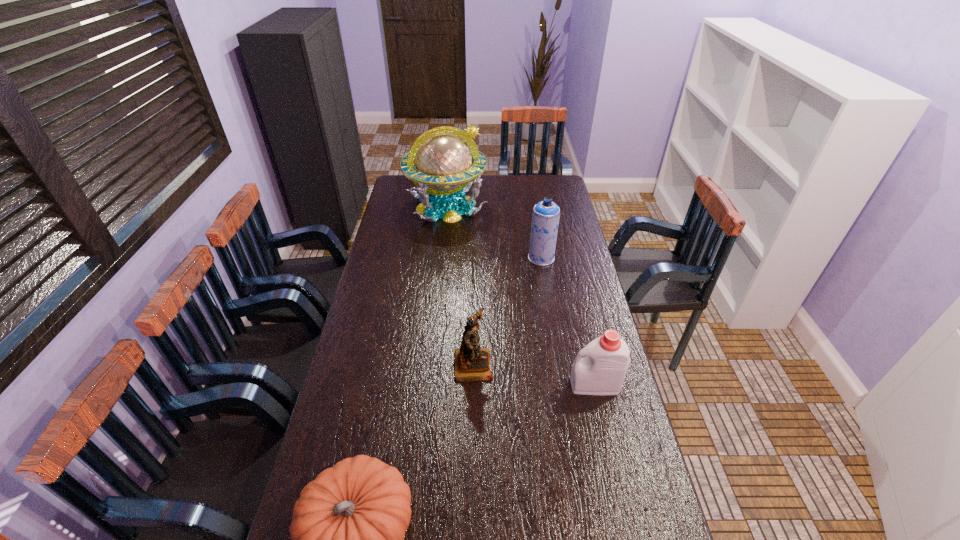
This screenshot has height=540, width=960. In order to click on globe in this screenshot , I will do `click(445, 165)`.

Locate an element on the screen. The width and height of the screenshot is (960, 540). the tallest object is located at coordinates (445, 165).

This screenshot has width=960, height=540. What are the coordinates of `aerosol can` in the screenshot? It's located at (545, 219).

The height and width of the screenshot is (540, 960). I want to click on the second farthest object, so click(545, 219).

Locate an element on the screen. The image size is (960, 540). figurine is located at coordinates (471, 363).

What are the coordinates of `detergent` in the screenshot? It's located at (602, 371).

Identify the location of vacant space located 0.370m on the right of the tallest object. The image size is (960, 540). (561, 206).

Identify the location of free spot located on the back of the fourth nearest object. The height and width of the screenshot is (540, 960). (537, 228).

At what (x,y) coordinates should I click in order to perform the action: click on free region located 0.170m on the front-facing side of the figurine. Please return your answer as a coordinate pair (x, y). This screenshot has height=540, width=960. Looking at the image, I should click on (543, 363).

Locate an element on the screen. vacant region located on the handle side of the detergent is located at coordinates (498, 385).